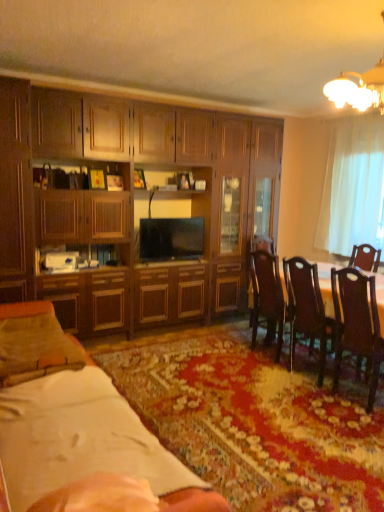
You are a GUI agent. You are given a task and a screenshot of the screen. Output one action in this format:
    pyautogui.click(x=<x>, y=<y>)
    Task: Click on the space that is in front of dark brown wood chair at center right, the second chair viewed from the right
    
    Given the screenshot: What is the action you would take?
    pyautogui.click(x=262, y=375)